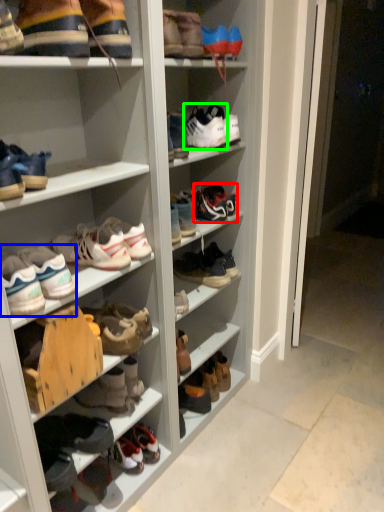
Question: Which object is the farthest from footwear (highlighted by a red box)? Choose among these: footwear (highlighted by a blue box) or footwear (highlighted by a green box).

Choices:
 (A) footwear
 (B) footwear

Answer: (A)